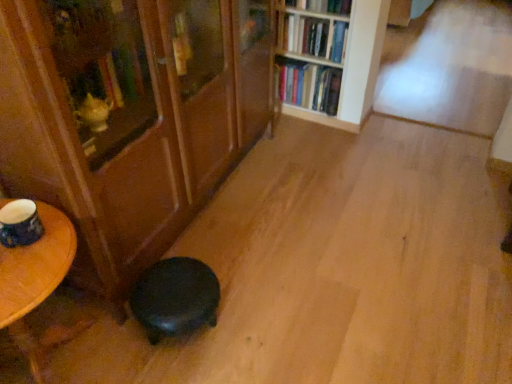
Find the location of `wooden bookshelf at upper center, the second bookcase positioned from the left`. wooden bookshelf at upper center, the second bookcase positioned from the left is located at coordinates (332, 60).

The image size is (512, 384). Describe the element at coordinates (332, 60) in the screenshot. I see `wooden bookshelf at upper center, the second bookcase positioned from the left` at that location.

Image resolution: width=512 pixels, height=384 pixels. Identify the location of wooden round table at lower left. (34, 280).

You are a GUI agent. You are given a task and a screenshot of the screen. Output one action in this format:
    pyautogui.click(x=<x>, y=<y>)
    Task: Click on the hardcover book at upper center, marked as the 1th book in a top-to-bottom arrangement
    Image resolution: width=512 pixels, height=384 pixels.
    Given the screenshot: What is the action you would take?
    pyautogui.click(x=322, y=6)

Locate an element on the screen. wooden bookshelf at upper center, the second bookcase positioned from the left is located at coordinates [332, 60].

Locate an element on the screen. The height and width of the screenshot is (384, 512). bookcase that is the 2nd object above the wooden round table at lower left (from a real-world perspective) is located at coordinates (129, 117).

Could you measure the distance between wooden round table at lower left and matte wood bookcase at lower left, placed as the 2th bookcase when sorted from right to left?

They are 19.68 inches apart.

Would you say wooden round table at lower left is a long distance from matte wood bookcase at lower left, placed as the 2th bookcase when sorted from right to left?

wooden round table at lower left is near matte wood bookcase at lower left, placed as the 2th bookcase when sorted from right to left, not far away.

Between wooden round table at lower left and matte wood bookcase at lower left, placed as the 2th bookcase when sorted from right to left, which one has more height?

Standing taller between the two is matte wood bookcase at lower left, placed as the 2th bookcase when sorted from right to left.

Consider the image. Can we say wooden round table at lower left lies outside hardcover books at upper center, the third book viewed from the top?

Indeed, wooden round table at lower left is completely outside hardcover books at upper center, the third book viewed from the top.

Is wooden round table at lower left facing towards hardcover books at upper center, the third book viewed from the top?

No, wooden round table at lower left does not turn towards hardcover books at upper center, the third book viewed from the top.

From the image's perspective, does wooden round table at lower left appear higher than hardcover books at upper center, which appears as the 1th book when ordered from the bottom?

No, from the image's perspective, wooden round table at lower left is not above hardcover books at upper center, which appears as the 1th book when ordered from the bottom.

Is wooden round table at lower left wider than hardcover books at upper center, the third book viewed from the top?

Correct, the width of wooden round table at lower left exceeds that of hardcover books at upper center, the third book viewed from the top.

Is matte wood bookcase at lower left, marked as the 1th bookcase in a left-to-right arrangement, outside of black matte stool at lower left?

Yes, matte wood bookcase at lower left, marked as the 1th bookcase in a left-to-right arrangement, is located beyond the bounds of black matte stool at lower left.

From the image's perspective, which is above, matte wood bookcase at lower left, marked as the 1th bookcase in a left-to-right arrangement, or black matte stool at lower left?

matte wood bookcase at lower left, marked as the 1th bookcase in a left-to-right arrangement, appears higher in the image.

Is point (73, 164) positioned after point (198, 288)?

No.

Is hardcover books at upper center, which appears as the 1th book when ordered from the bottom, aimed at hardcover book at upper center, marked as the 1th book in a top-to-bottom arrangement?

No, hardcover books at upper center, which appears as the 1th book when ordered from the bottom, is not oriented towards hardcover book at upper center, marked as the 1th book in a top-to-bottom arrangement.

From the image's perspective, which one is positioned higher, hardcover books at upper center, which appears as the 1th book when ordered from the bottom, or hardcover book at upper center, which is counted as the third book, starting from the bottom?

hardcover book at upper center, which is counted as the third book, starting from the bottom, appears higher in the image.

Is hardcover books at upper center, which appears as the 1th book when ordered from the bottom, shorter than hardcover book at upper center, which is counted as the third book, starting from the bottom?

Incorrect, the height of hardcover books at upper center, which appears as the 1th book when ordered from the bottom, does not fall short of that of hardcover book at upper center, which is counted as the third book, starting from the bottom.

Locate an element on the screen. the 2nd book below the hardcover book at upper center, which is counted as the third book, starting from the bottom (from the image's perspective) is located at coordinates (309, 85).

Based on the photo, in terms of width, does hardcover books at upper center, which appears as the 1th book when ordered from the bottom, look wider or thinner when compared to black matte stool at lower left?

hardcover books at upper center, which appears as the 1th book when ordered from the bottom, is thinner than black matte stool at lower left.

Who is more distant, hardcover books at upper center, the third book viewed from the top, or black matte stool at lower left?

Positioned behind is hardcover books at upper center, the third book viewed from the top.

From a real-world perspective, which object rests below the other?

black matte stool at lower left.

From the hardcover books at upper center, which ranks as the second book in bottom-to-top order, count 2nd bookcases forward and point to it. Please provide its 2D coordinates.

[(129, 117)]

From the image's perspective, which one is positioned higher, hardcover books at upper center, which ranks as the second book in bottom-to-top order, or matte wood bookcase at lower left, placed as the 2th bookcase when sorted from right to left?

hardcover books at upper center, which ranks as the second book in bottom-to-top order, is shown above in the image.

How much distance is there between hardcover books at upper center, which ranks as the second book in bottom-to-top order, and matte wood bookcase at lower left, marked as the 1th bookcase in a left-to-right arrangement?

hardcover books at upper center, which ranks as the second book in bottom-to-top order, and matte wood bookcase at lower left, marked as the 1th bookcase in a left-to-right arrangement, are 3.91 feet apart.

Which is farther from the camera, (331, 53) or (112, 188)?

The point (331, 53) is farther from the camera.

From a real-world perspective, is wooden bookshelf at upper center, the second bookcase positioned from the left, located beneath hardcover book at upper center, which is counted as the third book, starting from the bottom?

Yes, from a real-world perspective, wooden bookshelf at upper center, the second bookcase positioned from the left, is below hardcover book at upper center, which is counted as the third book, starting from the bottom.

Considering the positions of objects wooden bookshelf at upper center, which appears as the first bookcase when viewed from the right, and hardcover book at upper center, marked as the 1th book in a top-to-bottom arrangement, in the image provided, who is behind, wooden bookshelf at upper center, which appears as the first bookcase when viewed from the right, or hardcover book at upper center, marked as the 1th book in a top-to-bottom arrangement,?

hardcover book at upper center, marked as the 1th book in a top-to-bottom arrangement, is further from the camera.

Between wooden bookshelf at upper center, which appears as the first bookcase when viewed from the right, and hardcover book at upper center, marked as the 1th book in a top-to-bottom arrangement, which one has smaller size?

hardcover book at upper center, marked as the 1th book in a top-to-bottom arrangement, is smaller.

From the image's perspective, would you say wooden bookshelf at upper center, the second bookcase positioned from the left, is positioned over hardcover book at upper center, marked as the 1th book in a top-to-bottom arrangement?

No, from the image's perspective, wooden bookshelf at upper center, the second bookcase positioned from the left, is not on top of hardcover book at upper center, marked as the 1th book in a top-to-bottom arrangement.

You are a GUI agent. You are given a task and a screenshot of the screen. Output one action in this format:
    pyautogui.click(x=<x>, y=<y>)
    Task: Click on the table behind the matte wood bookcase at lower left, marked as the 1th bookcase in a left-to-right arrangement
    
    Given the screenshot: What is the action you would take?
    [x=34, y=280]

This screenshot has height=384, width=512. Identify the location of the 3rd book counting from the right side of the wooden round table at lower left. (309, 85).

Estimate the real-world distances between objects in this image. Which object is closer to hardcover books at upper center, which ranks as the second book in bottom-to-top order, black matte stool at lower left or matte wood bookcase at lower left, placed as the 2th bookcase when sorted from right to left?

matte wood bookcase at lower left, placed as the 2th bookcase when sorted from right to left.

Looking at this image, considering their positions, is wooden bookshelf at upper center, the second bookcase positioned from the left, positioned closer to hardcover books at upper center, which appears as the 1th book when ordered from the bottom, than matte wood bookcase at lower left, marked as the 1th bookcase in a left-to-right arrangement?

Based on the image, wooden bookshelf at upper center, the second bookcase positioned from the left, appears to be nearer to hardcover books at upper center, which appears as the 1th book when ordered from the bottom.

Considering their positions, is black matte stool at lower left positioned further to matte wood bookcase at lower left, placed as the 2th bookcase when sorted from right to left, than wooden bookshelf at upper center, which appears as the first bookcase when viewed from the right?

wooden bookshelf at upper center, which appears as the first bookcase when viewed from the right.

Based on their spatial positions, is wooden bookshelf at upper center, the second bookcase positioned from the left, or hardcover books at upper center, which ranks as the second book in top-to-bottom order, further from matte wood bookcase at lower left, marked as the 1th bookcase in a left-to-right arrangement?

Among the two, hardcover books at upper center, which ranks as the second book in top-to-bottom order, is located further to matte wood bookcase at lower left, marked as the 1th bookcase in a left-to-right arrangement.

Considering their positions, is matte wood bookcase at lower left, marked as the 1th bookcase in a left-to-right arrangement, positioned further to wooden round table at lower left than hardcover book at upper center, marked as the 1th book in a top-to-bottom arrangement?

The object further to wooden round table at lower left is hardcover book at upper center, marked as the 1th book in a top-to-bottom arrangement.

Looking at the image, which one is located closer to black matte stool at lower left, hardcover books at upper center, which ranks as the second book in bottom-to-top order, or hardcover book at upper center, marked as the 1th book in a top-to-bottom arrangement?

hardcover books at upper center, which ranks as the second book in bottom-to-top order, is closer to black matte stool at lower left.

From the image, which object appears to be nearer to hardcover books at upper center, which appears as the 1th book when ordered from the bottom, hardcover books at upper center, which ranks as the second book in top-to-bottom order, or wooden bookshelf at upper center, the second bookcase positioned from the left?

Among the two, wooden bookshelf at upper center, the second bookcase positioned from the left, is located nearer to hardcover books at upper center, which appears as the 1th book when ordered from the bottom.

When comparing their distances from hardcover books at upper center, which ranks as the second book in bottom-to-top order, does wooden round table at lower left or matte wood bookcase at lower left, placed as the 2th bookcase when sorted from right to left, seem closer?

matte wood bookcase at lower left, placed as the 2th bookcase when sorted from right to left, is positioned closer to the anchor hardcover books at upper center, which ranks as the second book in bottom-to-top order.

Locate an element on the screen. The height and width of the screenshot is (384, 512). bookcase between wooden round table at lower left and hardcover books at upper center, which appears as the 1th book when ordered from the bottom, in the front-back direction is located at coordinates (332, 60).

Where is `table between hardcover book at upper center, which is counted as the third book, starting from the bottom, and black matte stool at lower left, in the vertical direction`? Image resolution: width=512 pixels, height=384 pixels. table between hardcover book at upper center, which is counted as the third book, starting from the bottom, and black matte stool at lower left, in the vertical direction is located at coordinates (34, 280).

I want to click on bookcase between matte wood bookcase at lower left, marked as the 1th bookcase in a left-to-right arrangement, and hardcover books at upper center, which ranks as the second book in bottom-to-top order, in the front-back direction, so click(x=332, y=60).

You are a GUI agent. You are given a task and a screenshot of the screen. Output one action in this format:
    pyautogui.click(x=<x>, y=<y>)
    Task: Click on the book between wooden bookshelf at upper center, the second bookcase positioned from the left, and black matte stool at lower left in the up-down direction
    This screenshot has height=384, width=512.
    Given the screenshot: What is the action you would take?
    (309, 85)